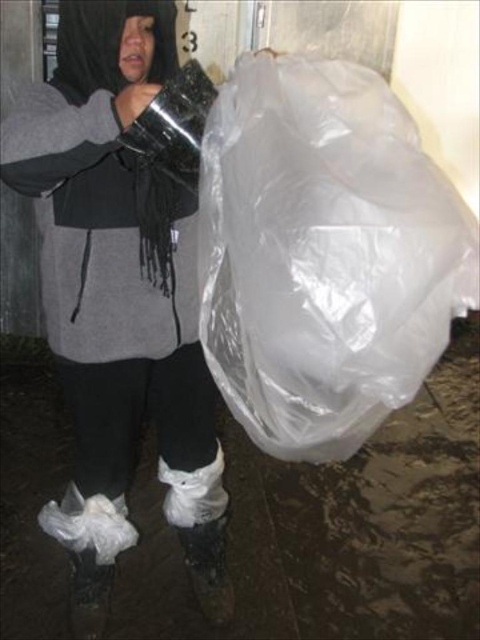
Question: Among these objects, which one is nearest to the camera?

Choices:
 (A) white matte boot at lower center
 (B) transparent plastic bag at right
 (C) transparent plastic bag at upper right

Answer: (B)

Question: Is transparent plastic bag at right above transparent plastic bag at upper right?

Choices:
 (A) no
 (B) yes

Answer: (B)

Question: Which point is closer to the camera?

Choices:
 (A) transparent plastic bag at right
 (B) transparent plastic bag at upper right

Answer: (A)

Question: In this image, where is transparent plastic bag at right located relative to white matte boot at lower center?

Choices:
 (A) right
 (B) left

Answer: (A)

Question: Is transparent plastic bag at right wider than transparent plastic bag at upper right?

Choices:
 (A) yes
 (B) no

Answer: (B)

Question: Which object is farther from the camera taking this photo?

Choices:
 (A) transparent plastic bag at right
 (B) transparent plastic bag at upper right
 (C) white matte boot at lower center

Answer: (C)